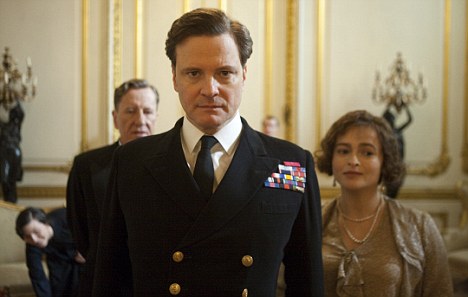
Locate an element on the screen. The width and height of the screenshot is (468, 297). light is located at coordinates (14, 84), (398, 78).